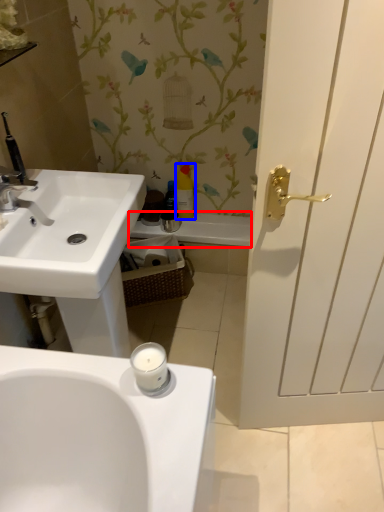
Question: Among these objects, which one is nearest to the camera, bath (highlighted by a red box) or toiletry (highlighted by a blue box)?

Choices:
 (A) bath
 (B) toiletry

Answer: (B)